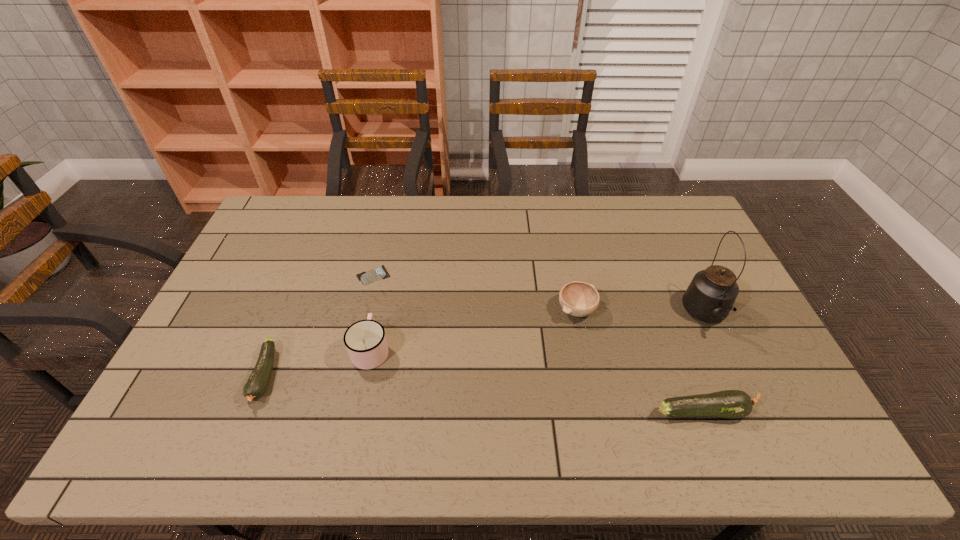
Where is `free point located on the right of the farthest object`? This screenshot has height=540, width=960. free point located on the right of the farthest object is located at coordinates (471, 275).

What are the coordinates of `blank area located 0.280m on the side of the mug with the handle` in the screenshot? It's located at (389, 263).

This screenshot has width=960, height=540. I want to click on free space located on the side of the mug with the handle, so click(386, 278).

Locate an element on the screen. The height and width of the screenshot is (540, 960). free location located 0.070m on the side of the mug with the handle is located at coordinates (379, 311).

The image size is (960, 540). Find the location of `vacant space situated on the right of the third object from right to left`. vacant space situated on the right of the third object from right to left is located at coordinates (730, 310).

I want to click on zucchini at the right edge, so click(x=731, y=404).

I want to click on kettle at the right edge, so click(x=710, y=296).

Locate an element on the screen. This screenshot has height=540, width=960. object present at the near right corner is located at coordinates (731, 404).

In the image, there is a desktop. Where is `free space at the far edge`? Image resolution: width=960 pixels, height=540 pixels. free space at the far edge is located at coordinates (625, 218).

Image resolution: width=960 pixels, height=540 pixels. In the image, there is a desktop. In order to click on free region at the near edge in this screenshot , I will do `click(246, 404)`.